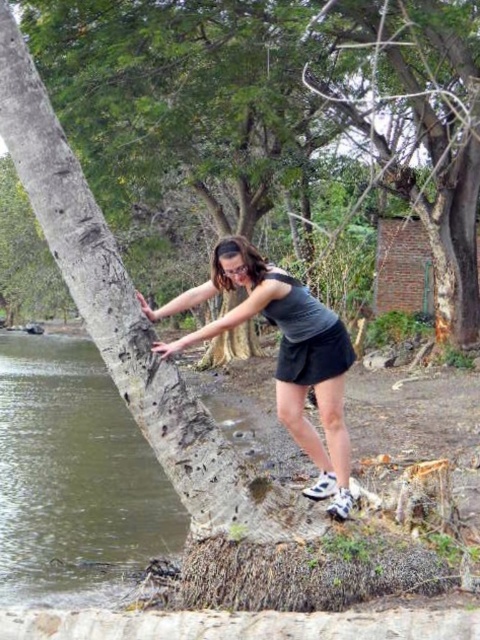
Question: Is the position of rough bark tree at left more distant than that of matte gray tank top at center?

Choices:
 (A) yes
 (B) no

Answer: (A)

Question: Does rough bark tree at left come in front of matte gray tank top at center?

Choices:
 (A) no
 (B) yes

Answer: (A)

Question: Which object is closer to the camera taking this photo?

Choices:
 (A) rough bark tree at left
 (B) matte gray tank top at center

Answer: (B)

Question: Can you confirm if rough bark tree at left is bigger than matte gray tank top at center?

Choices:
 (A) yes
 (B) no

Answer: (A)

Question: Among these points, which one is nearest to the camera?

Choices:
 (A) (398, 44)
 (B) (335, 344)

Answer: (B)